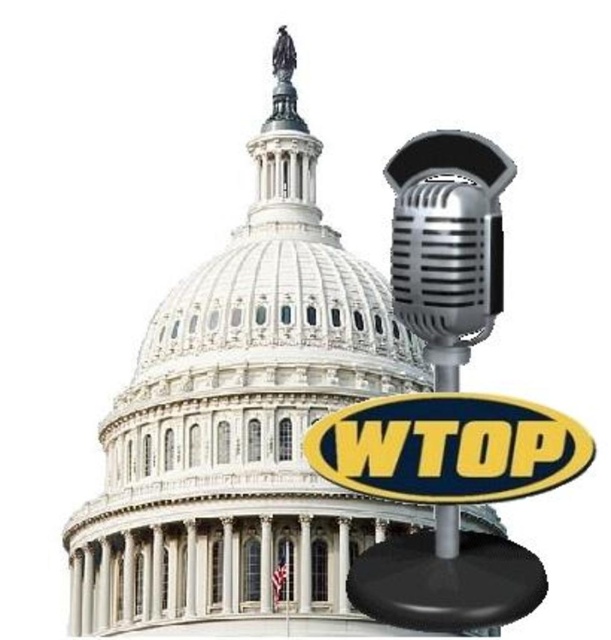
You are a photographer standing in front of the United States Capitol building. You want to take a photo that includes both the yellowmaterial sign at center and the black plastic microphone at right. Based on their positions, which object will appear closer to you in the photo?

The yellowmaterial sign at center is in front of the black plastic microphone at right, so it will appear closer to you in the photo.

You are designing a poster for a political event and need to place both the yellowmaterial sign at center and the shiny silver microphone at right. Based on their sizes, which object should you place first to ensure they fit well on the poster?

The yellowmaterial sign at center should be placed first since it occupies less space than the shiny silver microphone at right, allowing more room for the larger microphone.

You are designing a layout for a news broadcast set. The United States Capitol dome is displayed centrally, and you need to position the shiny silver microphone at right. According to the spatial information, where should the microphone be placed relative to the Capitol?

The shiny silver microphone at right should be positioned at point 0.367 on the x axis and 0.733 on the y axis relative to the Capitol dome.